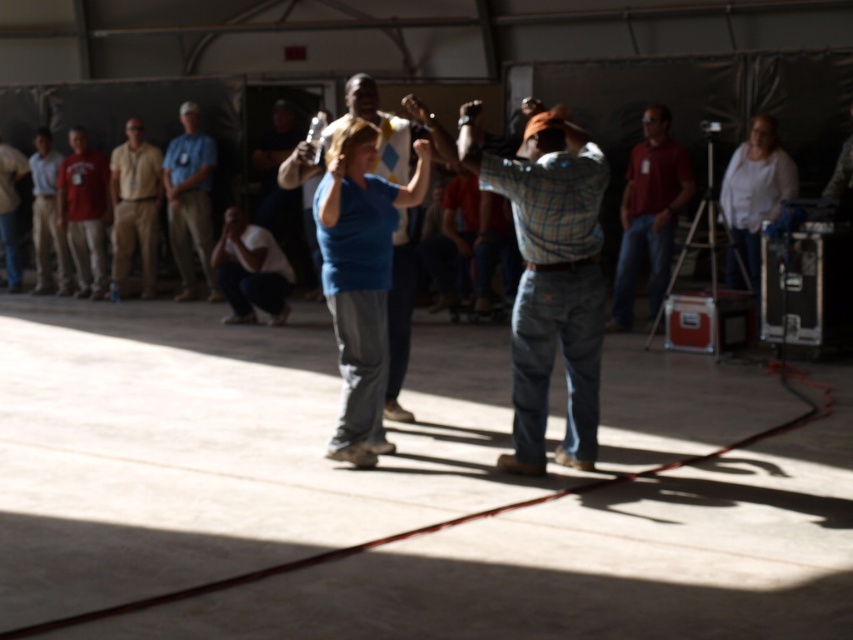
Question: Among these objects, which one is nearest to the camera?

Choices:
 (A) white cotton shirt at lower center
 (B) matte khaki pants at left

Answer: (A)

Question: In this image, where is beige cotton shirt at left located relative to light blue shirt at left?

Choices:
 (A) above
 (B) below

Answer: (B)

Question: Which point is closer to the camera?

Choices:
 (A) light blue shirt at left
 (B) white cotton shirt at lower center
 (C) plaid shirt at center

Answer: (C)

Question: Which object appears closest to the camera in this image?

Choices:
 (A) beige cotton shirt at left
 (B) matte khaki pants at left

Answer: (A)

Question: Does blue cotton shirt at center come behind matte khaki pants at left?

Choices:
 (A) no
 (B) yes

Answer: (A)

Question: Is plaid shirt at center in front of white cotton shirt at lower center?

Choices:
 (A) no
 (B) yes

Answer: (B)